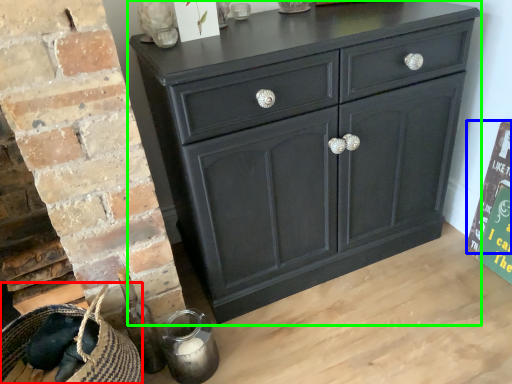
Question: Estimate the real-world distances between objects in this image. Which object is closer to basket (highlighted by a red box), bulletin board (highlighted by a blue box) or chest of drawers (highlighted by a green box)?

Choices:
 (A) bulletin board
 (B) chest of drawers

Answer: (B)